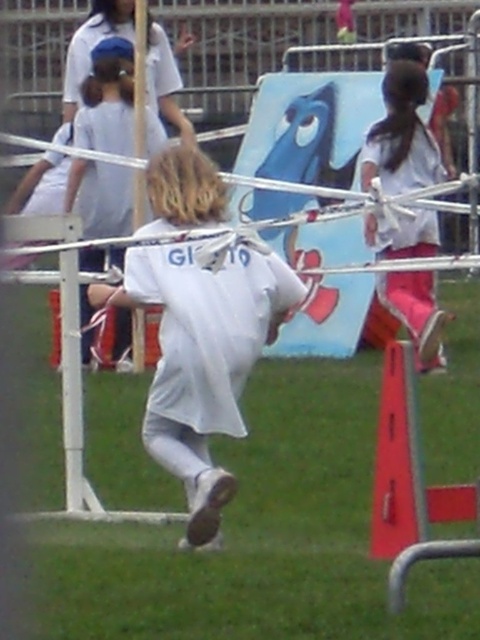
Based on the scene described, can you determine if the white matte shirt at center is wider than the pink fabric pants at right?

The white matte shirt at center might be wider than pink fabric pants at right according to the description.

You are a photographer at the event and need to adjust your camera to focus on both the white matte shirt at center and the pink fabric pants at right. Which object should you focus on first if you want to capture the one closer to you?

The white matte shirt at center has a lesser height compared to pink fabric pants at right, so you should focus on the white matte shirt at center first since it is closer to you.

You are a photographer trying to capture the athlete wearing the white matte shirt at center. What are the coordinates where you should focus your camera?

The coordinates to focus on are point (202, 356).